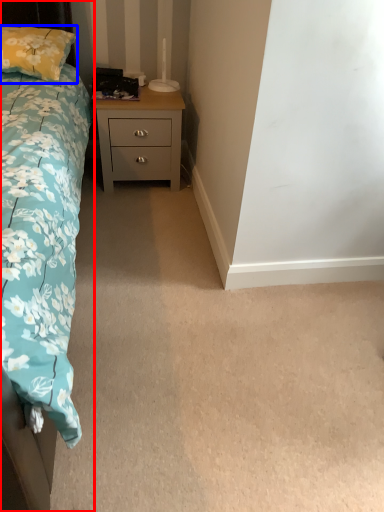
Question: Which object is closer to the camera taking this photo, bed (highlighted by a red box) or pillow (highlighted by a blue box)?

Choices:
 (A) bed
 (B) pillow

Answer: (A)